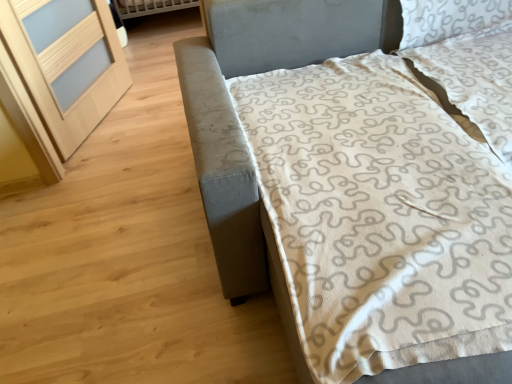
Question: Is white textured pillow at upper right aimed at textured gray bed at right?

Choices:
 (A) yes
 (B) no

Answer: (A)

Question: Can you confirm if white textured pillow at upper right is thinner than textured gray bed at right?

Choices:
 (A) no
 (B) yes

Answer: (B)

Question: Is white textured pillow at upper right looking in the opposite direction of textured gray bed at right?

Choices:
 (A) yes
 (B) no

Answer: (A)

Question: Would you say textured gray bed at right is part of white textured pillow at upper right's contents?

Choices:
 (A) yes
 (B) no

Answer: (B)

Question: Is white textured pillow at upper right far away from textured gray bed at right?

Choices:
 (A) no
 (B) yes

Answer: (A)

Question: From the image's perspective, is textured gray bed at right positioned above or below light wood screen door at left?

Choices:
 (A) below
 (B) above

Answer: (A)

Question: Based on their positions, is textured gray bed at right located to the left or right of light wood screen door at left?

Choices:
 (A) left
 (B) right

Answer: (B)

Question: Considering the positions of textured gray bed at right and light wood screen door at left in the image, is textured gray bed at right bigger or smaller than light wood screen door at left?

Choices:
 (A) big
 (B) small

Answer: (A)

Question: In terms of height, does textured gray bed at right look taller or shorter compared to light wood screen door at left?

Choices:
 (A) tall
 (B) short

Answer: (B)

Question: From the image's perspective, is light wood screen door at left positioned above or below textured gray bed at right?

Choices:
 (A) above
 (B) below

Answer: (A)

Question: In terms of size, does light wood screen door at left appear bigger or smaller than textured gray bed at right?

Choices:
 (A) small
 (B) big

Answer: (A)

Question: Looking at their shapes, would you say light wood screen door at left is wider or thinner than textured gray bed at right?

Choices:
 (A) wide
 (B) thin

Answer: (B)

Question: Considering the positions of point (100, 117) and point (222, 180), is point (100, 117) closer or farther from the camera than point (222, 180)?

Choices:
 (A) farther
 (B) closer

Answer: (A)

Question: Is white textured pillow at upper right wider or thinner than textured gray bed at right?

Choices:
 (A) thin
 (B) wide

Answer: (A)

Question: From their relative heights in the image, would you say white textured pillow at upper right is taller or shorter than textured gray bed at right?

Choices:
 (A) tall
 (B) short

Answer: (B)